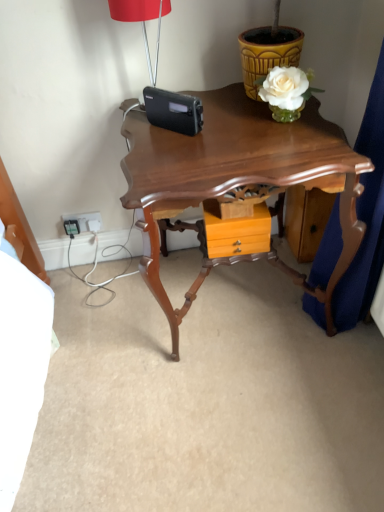
Locate an element on the screen. free space in front of yellow textured flowerpot at upper right is located at coordinates (253, 124).